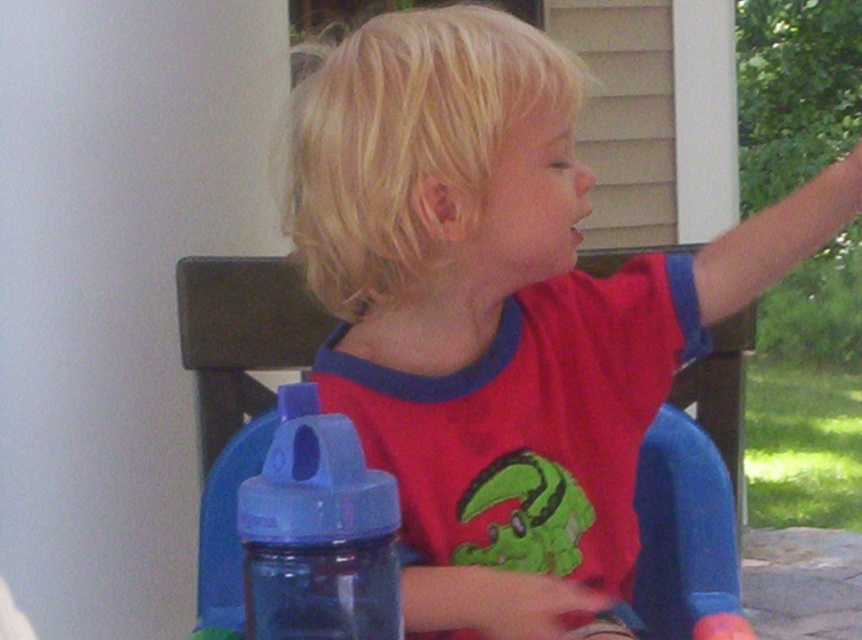
Question: Is blue plastic chair at center bigger than blue plastic bottle at lower left?

Choices:
 (A) yes
 (B) no

Answer: (A)

Question: Which point is closer to the camera taking this photo?

Choices:
 (A) (214, 310)
 (B) (470, 369)
 (C) (278, 420)

Answer: (C)

Question: Which object is the farthest from the matte plastic child at center?

Choices:
 (A) blue plastic bottle at lower left
 (B) blue plastic chair at center

Answer: (A)

Question: Can you confirm if matte plastic child at center is wider than blue plastic bottle at lower left?

Choices:
 (A) no
 (B) yes

Answer: (B)

Question: Is the position of matte plastic child at center less distant than that of blue plastic chair at center?

Choices:
 (A) no
 (B) yes

Answer: (B)

Question: Which point is closer to the camera?

Choices:
 (A) matte plastic child at center
 (B) blue plastic chair at center

Answer: (A)